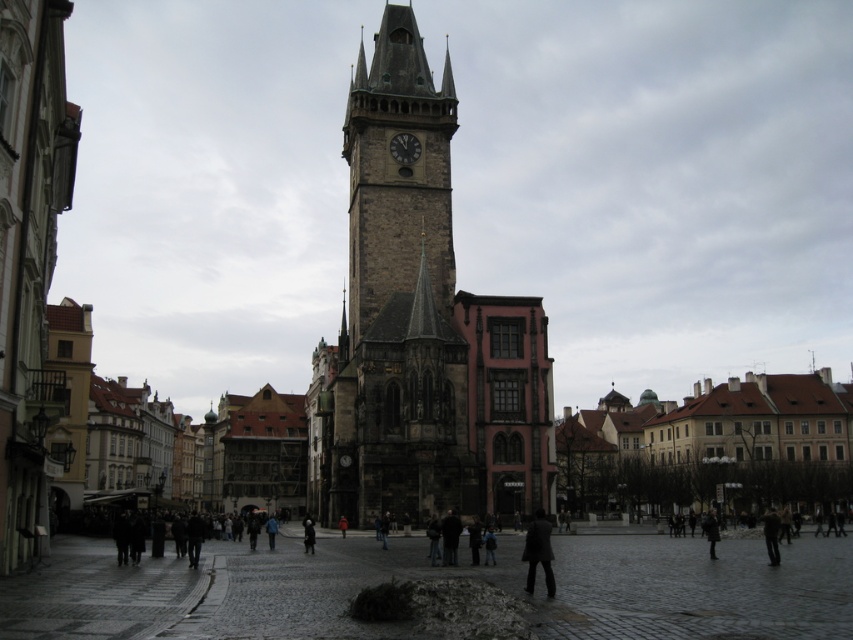
Question: Is stone clock tower at center positioned before dark gray coat at lower right?

Choices:
 (A) no
 (B) yes

Answer: (A)

Question: Does stone clock tower at center have a smaller size compared to dark gray coat at lower right?

Choices:
 (A) no
 (B) yes

Answer: (A)

Question: Which of the following is the farthest from the observer?

Choices:
 (A) stone clock tower at center
 (B) dark gray coat at lower right
 (C) dark gray stone clock at center

Answer: (C)

Question: Does dark gray coat at lower right have a greater width compared to dark gray stone clock at center?

Choices:
 (A) yes
 (B) no

Answer: (A)

Question: Which is nearer to the stone clock tower at center?

Choices:
 (A) dark gray stone clock at center
 (B) dark gray coat at lower right

Answer: (A)

Question: Estimate the real-world distances between objects in this image. Which object is closer to the dark gray coat at lower right?

Choices:
 (A) stone clock tower at center
 (B) dark gray stone clock at center

Answer: (A)